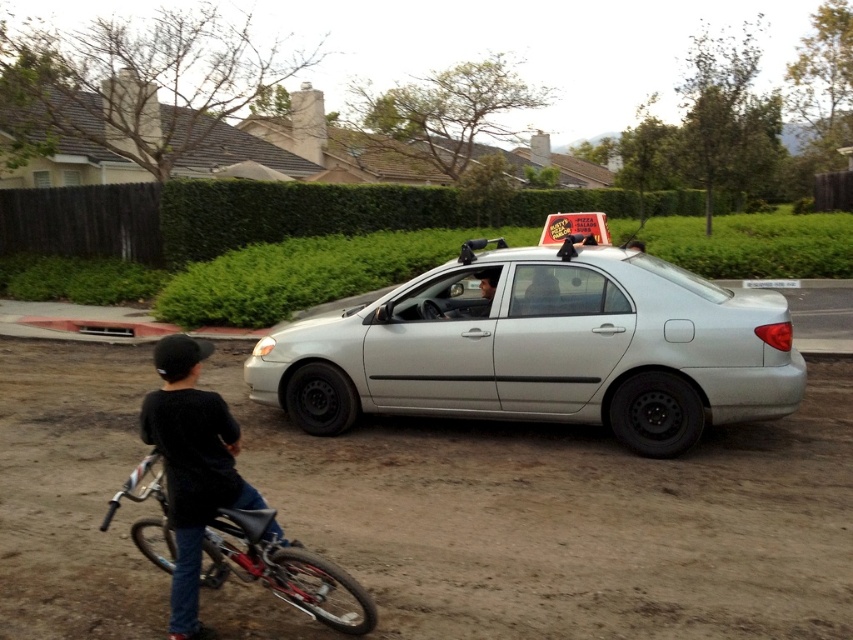
You are a delivery person who needs to park your vehicle. You see the silver metallic sedan at center and the reddish metallic bicycle at lower left. Which vehicle is positioned to the right side of the other?

The silver metallic sedan at center is positioned to the right of the reddish metallic bicycle at lower left.

You are a delivery driver who needs to park your car on the dirt track at lower left. However, your car requires a parking space larger than the white plastic license plate at center. Can you park your car there?

The dirt track at lower left has a smaller size compared to the white plastic license plate at center. Since the parking space must be larger than the license plate, the dirt track is not large enough to accommodate your car.